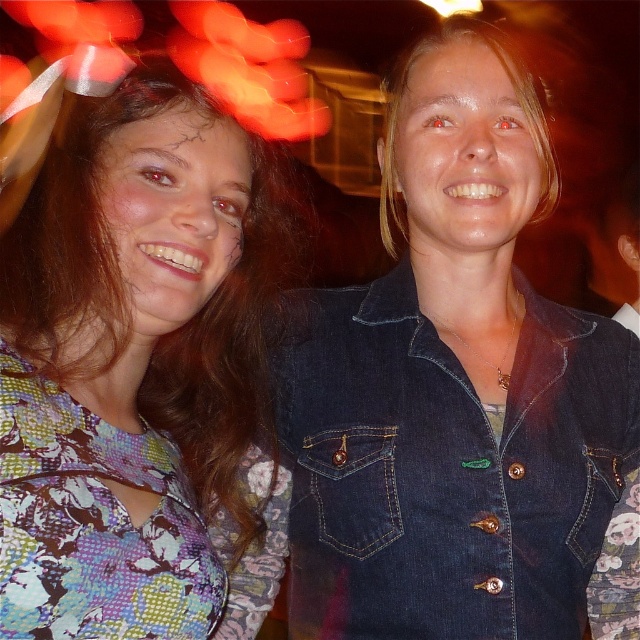
Question: Among these objects, which one is nearest to the camera?

Choices:
 (A) floral fabric dress at left
 (B) denim jacket at lower right

Answer: (A)

Question: Does denim jacket at lower right appear on the right side of floral fabric dress at left?

Choices:
 (A) yes
 (B) no

Answer: (A)

Question: Can you confirm if denim jacket at lower right is positioned above floral fabric dress at left?

Choices:
 (A) yes
 (B) no

Answer: (B)

Question: Does denim jacket at lower right have a smaller size compared to floral fabric dress at left?

Choices:
 (A) yes
 (B) no

Answer: (A)

Question: Among these objects, which one is farthest from the camera?

Choices:
 (A) denim jacket at lower right
 (B) floral fabric dress at left

Answer: (A)